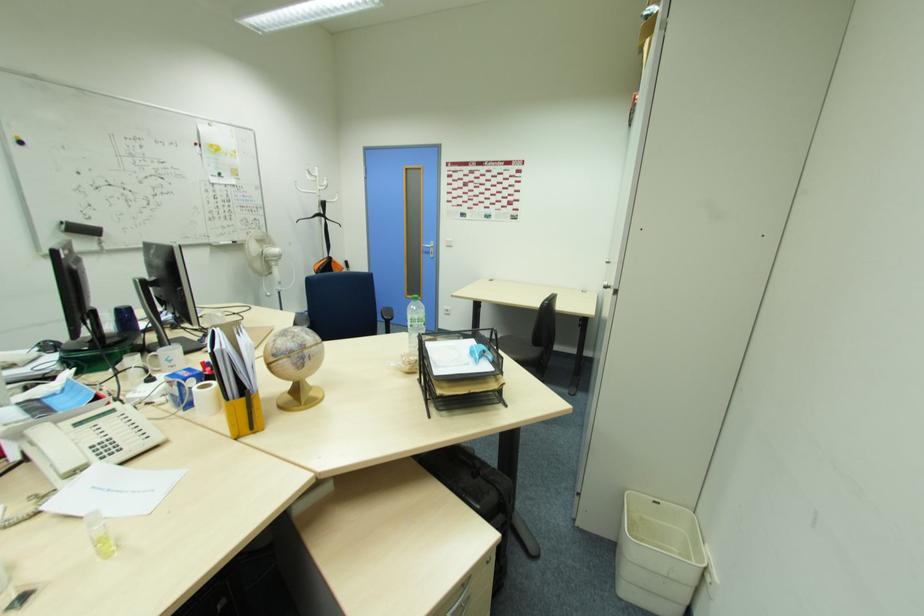
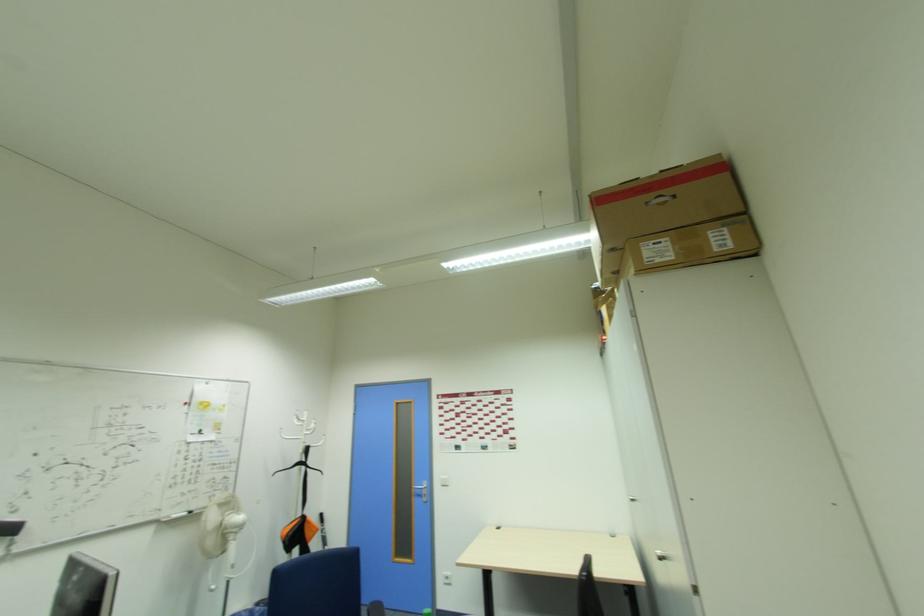
Question: How did the camera likely rotate?

Choices:
 (A) Left
 (B) Right
 (C) Up
 (D) Down

Answer: (C)